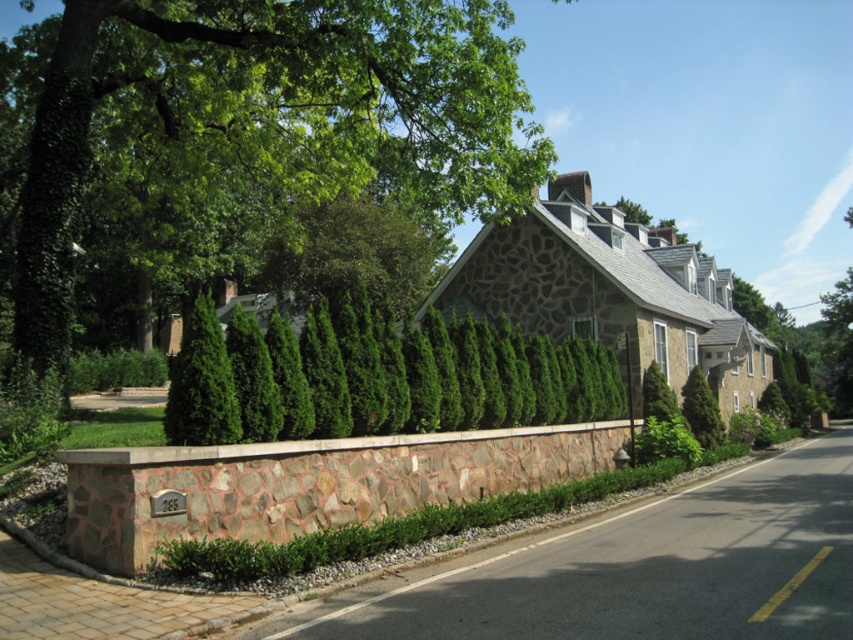
You are a landscape architect designing a new pathway between the green leafy tree at upper left and the green coniferous hedge at center. The pathway needs to be 10 meters long. Will the existing space accommodate this pathway?

The distance between the green leafy tree at upper left and the green coniferous hedge at center is 9.37 meters, which is shorter than the required 10 meters. Therefore, the existing space cannot accommodate a 10 meter long pathway between them.

You are standing in the front yard of the house and want to walk from the green leafy tree at upper left to the green coniferous hedge at center. Which direction should you move to reach the hedge?

You should move to the right to reach the green coniferous hedge at center because the green leafy tree at upper left is located to the left of it.

You are a landscape architect designing a new garden layout. You need to place a large statue that requires a space bigger than the green coniferous hedge at center. Can the green leafy tree at upper left accommodate this statue?

The green leafy tree at upper left has a larger size compared to the green coniferous hedge at center, so it can accommodate the statue requiring more space than the hedge.